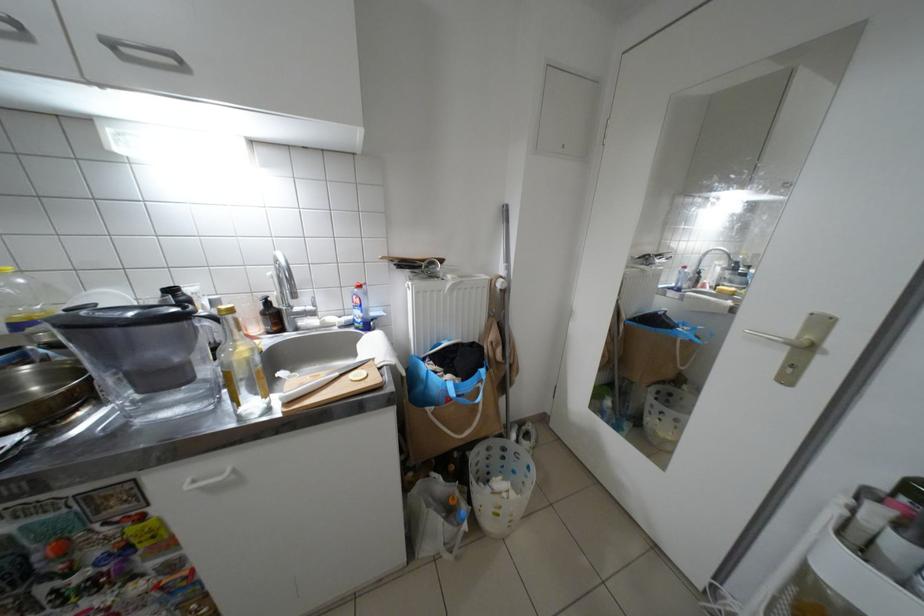
Where would you lift the knife? Please return your answer as a coordinate pair (x, y).

(319, 382)